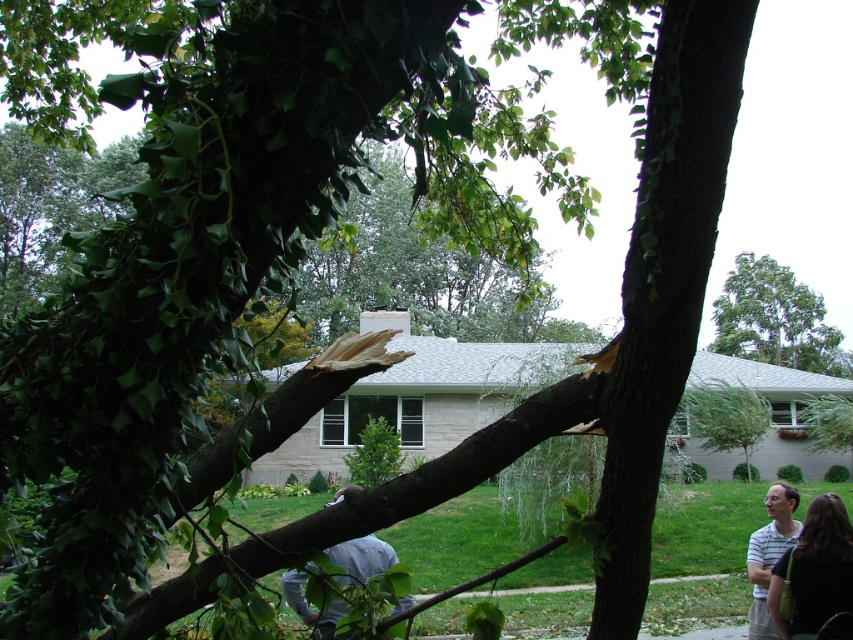
Question: Does green leafy tree at upper center lie behind striped cotton shirt at lower right?

Choices:
 (A) yes
 (B) no

Answer: (A)

Question: Which point is closer to the camera?

Choices:
 (A) striped cotton shirt at lower right
 (B) light gray fabric shirt at lower center
 (C) dark brown hair at lower right
 (D) green leafy tree at upper center

Answer: (B)

Question: Which point is closer to the camera taking this photo?

Choices:
 (A) (822, 506)
 (B) (297, 598)
 (C) (726, 333)

Answer: (A)

Question: Is light gray fabric shirt at lower center above striped cotton shirt at lower right?

Choices:
 (A) yes
 (B) no

Answer: (A)

Question: Where is dark brown hair at lower right located in relation to light gray fabric shirt at lower center in the image?

Choices:
 (A) left
 (B) right

Answer: (B)

Question: Which point appears closest to the camera in this image?

Choices:
 (A) (763, 579)
 (B) (770, 348)
 (C) (837, 561)

Answer: (C)